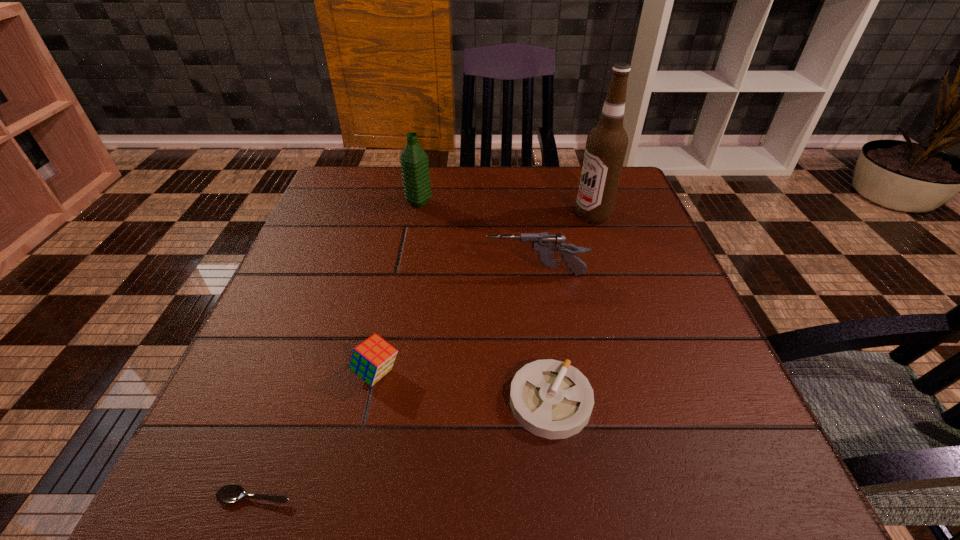
Identify the location of the rightmost object. (606, 145).

The image size is (960, 540). Find the location of `alcohol`. alcohol is located at coordinates (606, 145).

Where is `the second tallest object`? This screenshot has width=960, height=540. the second tallest object is located at coordinates (414, 161).

Identify the location of gun. Image resolution: width=960 pixels, height=540 pixels. (545, 245).

At what (x,y) coordinates should I click in order to perform the action: click on the fourth nearest object. Please return your answer as a coordinate pair (x, y). Looking at the image, I should click on (545, 245).

Where is `cube`? This screenshot has width=960, height=540. cube is located at coordinates (372, 359).

Locate an element on the screen. the fifth tallest object is located at coordinates (551, 399).

Where is `the nearest object`? The height and width of the screenshot is (540, 960). the nearest object is located at coordinates (229, 494).

At what (x,y) coordinates should I click in order to perform the action: click on the shortest object. Please return your answer as a coordinate pair (x, y). This screenshot has width=960, height=540. Looking at the image, I should click on (229, 494).

At what (x,y) coordinates should I click in order to perform the action: click on blank space located on the label of the alcohol. Please return your answer as a coordinate pair (x, y). The image size is (960, 540). Looking at the image, I should click on (431, 215).